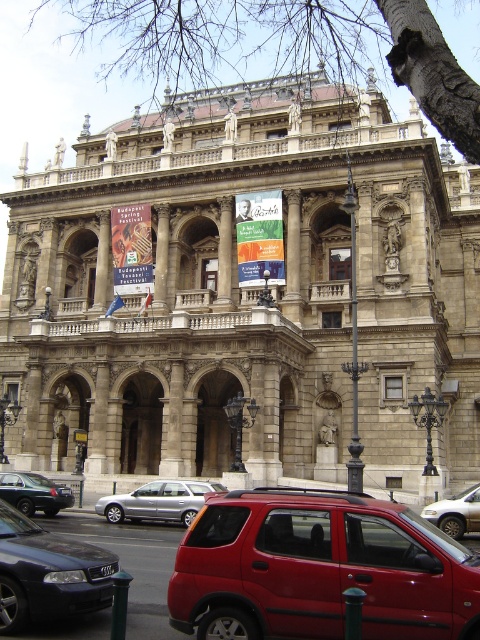
You are a tour guide leading a group to the entrance of the historic building. You have a black glossy sedan at lower left and a silver metallic sedan at center parked nearby. Your group is standing at the entrance. Which car is closer to you?

The black glossy sedan at lower left is closer to the entrance than the silver metallic sedan at center because they are 86.00 feet apart.